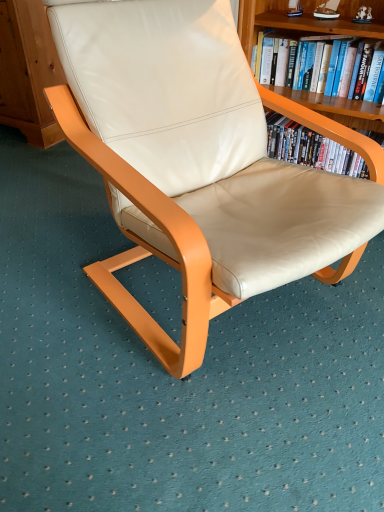
Question: From a real-world perspective, is beige leather chair at center on top of hardcover book at upper right?

Choices:
 (A) no
 (B) yes

Answer: (A)

Question: Is beige leather chair at center thinner than hardcover book at upper right?

Choices:
 (A) no
 (B) yes

Answer: (A)

Question: Is beige leather chair at center wider than hardcover book at upper right?

Choices:
 (A) no
 (B) yes

Answer: (B)

Question: Is beige leather chair at center bigger than hardcover book at upper right?

Choices:
 (A) no
 (B) yes

Answer: (B)

Question: Does beige leather chair at center appear on the left side of hardcover book at upper right?

Choices:
 (A) no
 (B) yes

Answer: (B)

Question: Is hardcover book at upper right bigger or smaller than beige leather chair at center?

Choices:
 (A) big
 (B) small

Answer: (B)

Question: Is hardcover book at upper right in front of or behind beige leather chair at center in the image?

Choices:
 (A) behind
 (B) front

Answer: (A)

Question: Does point (311, 73) appear closer or farther from the camera than point (182, 84)?

Choices:
 (A) closer
 (B) farther

Answer: (B)

Question: Based on their positions, is hardcover book at upper right located to the left or right of beige leather chair at center?

Choices:
 (A) left
 (B) right

Answer: (B)

Question: Relative to hardcover book at upper right, is beige leather chair at center in front or behind?

Choices:
 (A) front
 (B) behind

Answer: (A)

Question: Considering the positions of beige leather chair at center and hardcover book at upper right in the image, is beige leather chair at center taller or shorter than hardcover book at upper right?

Choices:
 (A) short
 (B) tall

Answer: (B)

Question: Is point (339, 221) closer or farther from the camera than point (365, 94)?

Choices:
 (A) farther
 (B) closer

Answer: (B)

Question: Would you say beige leather chair at center is inside or outside hardcover book at upper right?

Choices:
 (A) outside
 (B) inside

Answer: (A)

Question: Does point (332, 93) appear closer or farther from the camera than point (349, 124)?

Choices:
 (A) closer
 (B) farther

Answer: (B)

Question: From the image's perspective, is hardcover book at upper right located above or below wooden bookshelf at upper right?

Choices:
 (A) above
 (B) below

Answer: (A)